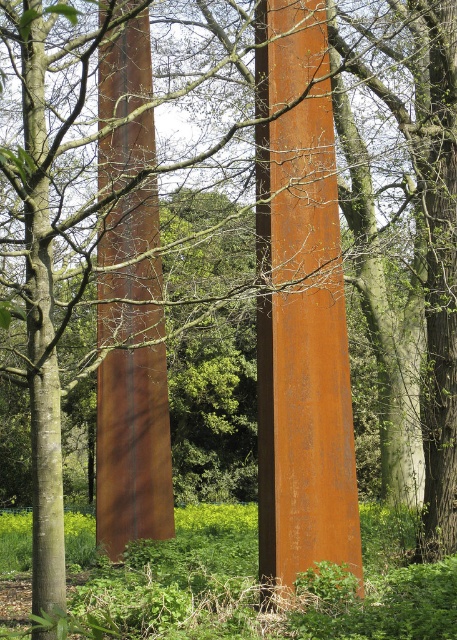
You are an artist planning to install a new sculpture between the rusty metal pole at center and the rusty metal pillar at center. Which structure should you place the sculpture closer to if you want it to appear proportionally balanced with both?

To achieve a proportionally balanced appearance, the sculpture should be placed closer to the rusty metal pillar at center since it is smaller than the rusty metal pole at center.

You are standing at the origin point in the image. There is a rusty metal pole at center represented by point [301,305]. Can you see the rusty metal pole at center from your current position?

Yes, since the point [301,305] represents the rusty metal pole at center, it is visible from the origin point.

You are a maintenance worker inspecting the two structures in the scene. You notice that the rusty metal pole at center and the rusty metal pillar at center are positioned in a way that could affect safety. Based on their spatial relationship, which one is at a higher elevation and needs immediate inspection?

The rusty metal pole at center is located above the rusty metal pillar at center, so the pole needs immediate inspection due to its higher elevation.